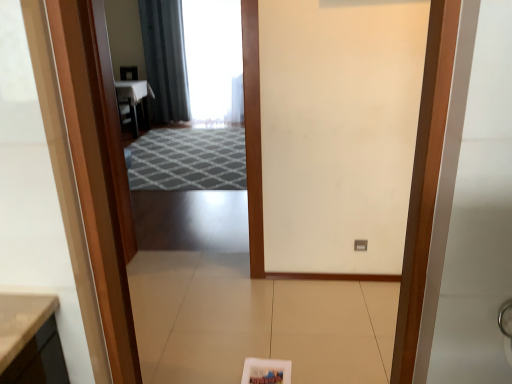
Locate an element on the screen. wooden door at center is located at coordinates (98, 168).

The image size is (512, 384). In order to click on gray textured rug at center in this screenshot , I will do `click(188, 160)`.

From a real-world perspective, which object stands above the other?

From a 3D spatial view, dark gray fabric curtain at upper center is above.

From the image's perspective, is dark gray fabric curtain at upper center on top of wooden door at center?

Correct, dark gray fabric curtain at upper center appears higher than wooden door at center in the image.

Between dark gray fabric curtain at upper center and wooden door at center, which one appears on the left side from the viewer's perspective?

dark gray fabric curtain at upper center.

Is point (176, 45) positioned after point (120, 201)?

Yes, it is.

Image resolution: width=512 pixels, height=384 pixels. Find the location of `doormat above the wooden door at center (from the image's perspective)`. doormat above the wooden door at center (from the image's perspective) is located at coordinates (188, 160).

Considering the points (188, 188) and (103, 304), which point is behind, point (188, 188) or point (103, 304)?

The point (188, 188) is more distant.

Looking at this image, from a real-world perspective, is gray textured rug at center under wooden door at center?

Yes, from a real-world perspective, gray textured rug at center is under wooden door at center.

Considering the sizes of dark gray fabric curtain at upper center and gray textured rug at center in the image, is dark gray fabric curtain at upper center wider or thinner than gray textured rug at center?

dark gray fabric curtain at upper center is thinner than gray textured rug at center.

Between dark gray fabric curtain at upper center and gray textured rug at center, which one is positioned in front?

gray textured rug at center is closer to the camera.

Is dark gray fabric curtain at upper center taller than gray textured rug at center?

Correct, dark gray fabric curtain at upper center is much taller as gray textured rug at center.

How different are the orientations of dark gray fabric curtain at upper center and gray textured rug at center in degrees?

The facing directions of dark gray fabric curtain at upper center and gray textured rug at center are 0.107 degrees apart.

Considering the relative sizes of wooden door at center and gray textured rug at center in the image provided, is wooden door at center wider than gray textured rug at center?

No.

Between point (100, 65) and point (156, 167), which one is positioned in front?

Positioned in front is point (100, 65).

From the image's perspective, relative to gray textured rug at center, is wooden door at center above or below?

Based on their image positions, wooden door at center is located beneath gray textured rug at center.

Which of these two, wooden door at center or gray textured rug at center, stands taller?

Standing taller between the two is wooden door at center.

Measure the distance between gray textured rug at center and dark gray fabric curtain at upper center.

A: 1.12 meters.

Between gray textured rug at center and dark gray fabric curtain at upper center, which one has smaller width?

Thinner between the two is dark gray fabric curtain at upper center.

From the image's perspective, is gray textured rug at center located beneath dark gray fabric curtain at upper center?

Yes, from the image's perspective, gray textured rug at center is below dark gray fabric curtain at upper center.

Looking at the image, does gray textured rug at center seem bigger or smaller compared to dark gray fabric curtain at upper center?

gray textured rug at center is smaller than dark gray fabric curtain at upper center.

From a real-world perspective, is wooden door at center on top of dark gray fabric curtain at upper center?

Incorrect, from a real-world perspective, wooden door at center is lower than dark gray fabric curtain at upper center.

Considering the relative sizes of wooden door at center and dark gray fabric curtain at upper center in the image provided, is wooden door at center bigger than dark gray fabric curtain at upper center?

Actually, wooden door at center might be smaller than dark gray fabric curtain at upper center.

Does wooden door at center turn towards dark gray fabric curtain at upper center?

No, wooden door at center is not aimed at dark gray fabric curtain at upper center.

Do you think wooden door at center is within dark gray fabric curtain at upper center, or outside of it?

wooden door at center cannot be found inside dark gray fabric curtain at upper center.

Where is `curtain behind the wooden door at center`? The height and width of the screenshot is (384, 512). curtain behind the wooden door at center is located at coordinates (165, 59).

The height and width of the screenshot is (384, 512). I want to click on doormat lying on the left of wooden door at center, so click(x=188, y=160).

Looking at the image, which one is located closer to gray textured rug at center, wooden door at center or dark gray fabric curtain at upper center?

Based on the image, dark gray fabric curtain at upper center appears to be nearer to gray textured rug at center.

Looking at the image, which one is located further to gray textured rug at center, dark gray fabric curtain at upper center or wooden door at center?

wooden door at center.

When comparing their distances from wooden door at center, does dark gray fabric curtain at upper center or gray textured rug at center seem further?

dark gray fabric curtain at upper center is further to wooden door at center.

From the image, which object appears to be nearer to dark gray fabric curtain at upper center, gray textured rug at center or wooden door at center?

gray textured rug at center.

When comparing their distances from wooden door at center, does gray textured rug at center or dark gray fabric curtain at upper center seem closer?

Among the two, gray textured rug at center is located nearer to wooden door at center.

Which object lies nearer to the anchor point dark gray fabric curtain at upper center, wooden door at center or gray textured rug at center?

gray textured rug at center is closer to dark gray fabric curtain at upper center.

Locate an element on the screen. The image size is (512, 384). doormat positioned between wooden door at center and dark gray fabric curtain at upper center from near to far is located at coordinates (188, 160).